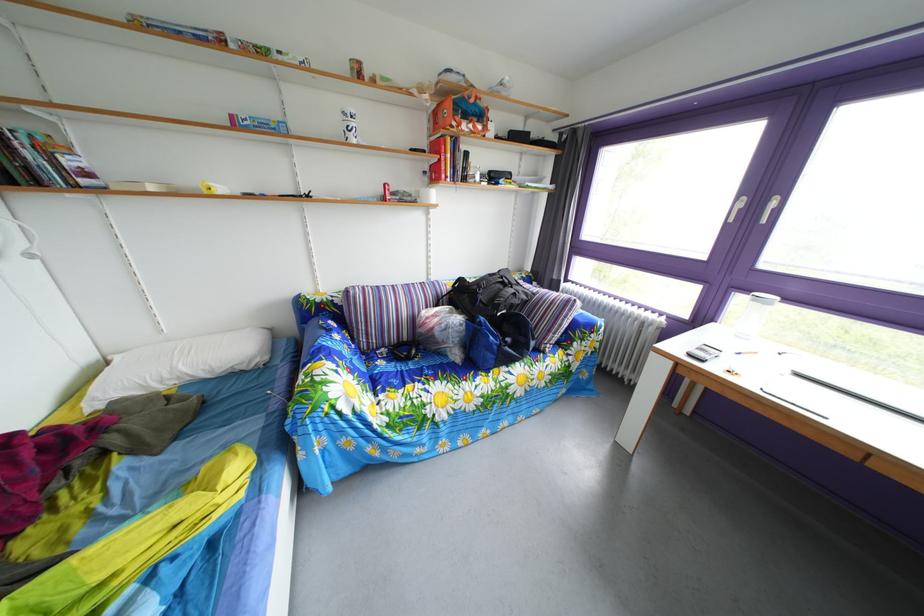
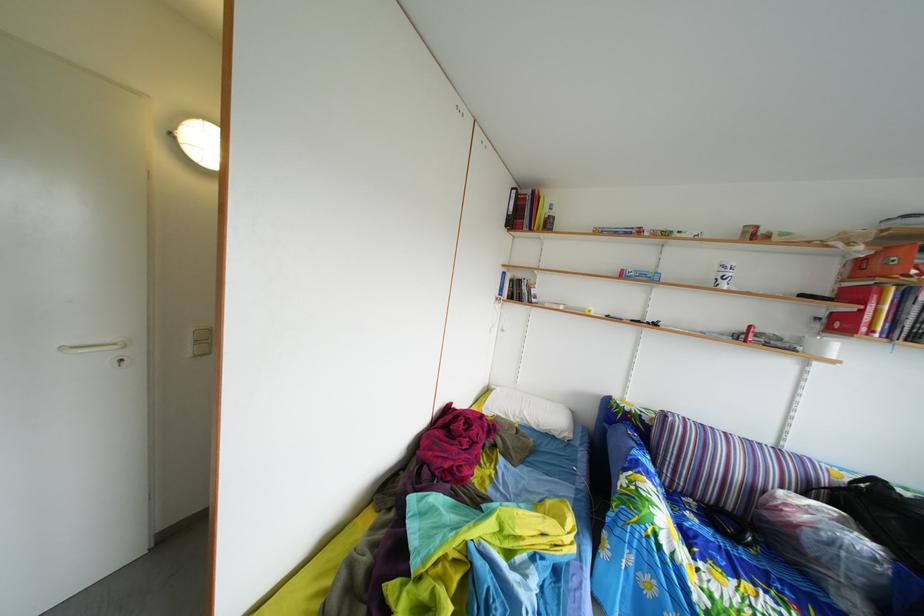
Where in the second image is the point corresponding to [448,108] from the first image?

(892, 256)